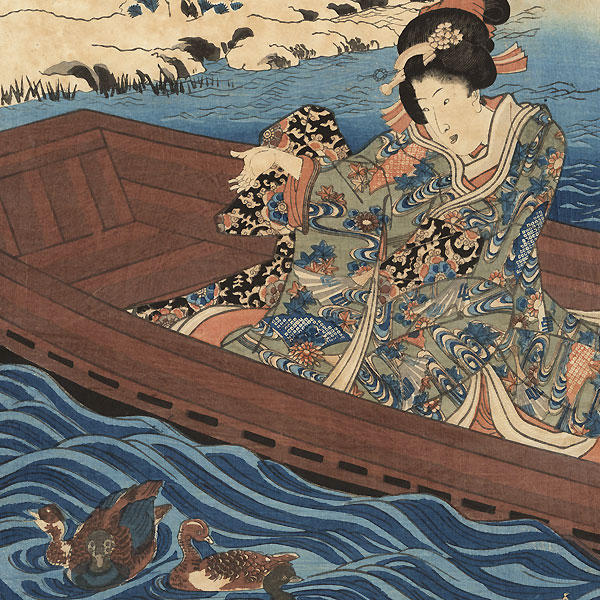
What are the coordinates of `japanese art print` in the screenshot? It's located at (343, 323).